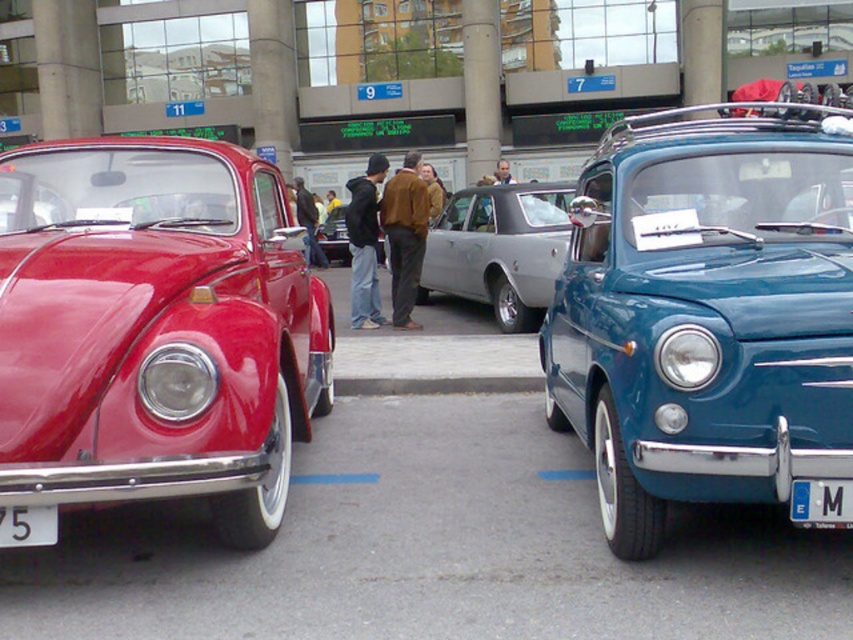
Question: In this image, where is black plastic license plate at lower left located relative to shiny black car at center?

Choices:
 (A) below
 (B) above

Answer: (A)

Question: Does teal glossy car at right have a smaller size compared to black plastic license plate at lower left?

Choices:
 (A) yes
 (B) no

Answer: (B)

Question: Among these objects, which one is nearest to the camera?

Choices:
 (A) black plastic license plate at lower left
 (B) white plastic license plate at center

Answer: (B)

Question: Which object appears closest to the camera in this image?

Choices:
 (A) silver metallic sedan at center
 (B) matte red car at left
 (C) white plastic license plate at center

Answer: (C)

Question: Is teal glossy car at right wider than matte red car at left?

Choices:
 (A) yes
 (B) no

Answer: (A)

Question: Which object is closer to the camera taking this photo?

Choices:
 (A) silver metallic sedan at center
 (B) white plastic license plate at center

Answer: (B)